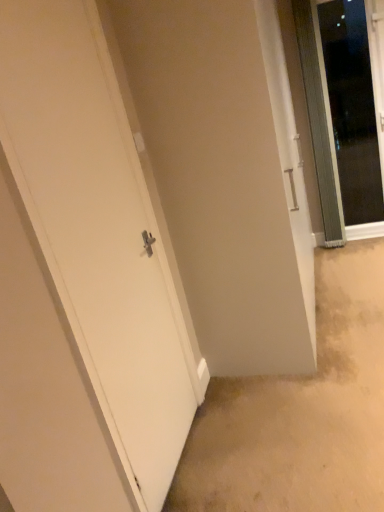
Question: Should I look upward or downward to see transparent glass door at upper right, the first door from the back?

Choices:
 (A) up
 (B) down

Answer: (A)

Question: Is transparent glass door at upper right, the 2th door positioned from the front, further to camera compared to white matte door at left, the second door when ordered from right to left?

Choices:
 (A) yes
 (B) no

Answer: (A)

Question: Could you tell me if transparent glass door at upper right, the 2th door positioned from the front, is facing white matte door at left, the second door when ordered from right to left?

Choices:
 (A) no
 (B) yes

Answer: (A)

Question: Is transparent glass door at upper right, the first door from the back, not near white matte door at left, the first door from the left?

Choices:
 (A) no
 (B) yes

Answer: (B)

Question: Is white matte door at left, which ranks as the 2th door in back-to-front order, at the back of transparent glass door at upper right, the 2th door positioned from the front?

Choices:
 (A) no
 (B) yes

Answer: (A)

Question: Can you confirm if transparent glass door at upper right, the 2th door positioned from the front, is positioned to the right of white matte door at left, which ranks as the 2th door in back-to-front order?

Choices:
 (A) yes
 (B) no

Answer: (A)

Question: Is transparent glass door at upper right, the first door from the back, next to white matte door at left, placed as the 1th door when sorted from front to back?

Choices:
 (A) yes
 (B) no

Answer: (B)

Question: From a real-world perspective, is white matte door at left, the first door from the left, below transparent glass door at upper right, the first door from the back?

Choices:
 (A) no
 (B) yes

Answer: (B)

Question: Can you confirm if white matte door at left, which ranks as the 2th door in back-to-front order, is wider than transparent glass door at upper right, the first door from the back?

Choices:
 (A) no
 (B) yes

Answer: (B)

Question: From the image's perspective, would you say white matte door at left, the first door from the left, is positioned over transparent glass door at upper right, which is counted as the 2th door, starting from the left?

Choices:
 (A) no
 (B) yes

Answer: (A)

Question: From a real-world perspective, is white matte door at left, the first door from the left, located higher than transparent glass door at upper right, marked as the first door in a right-to-left arrangement?

Choices:
 (A) yes
 (B) no

Answer: (B)

Question: Are white matte door at left, which ranks as the 2th door in back-to-front order, and transparent glass door at upper right, marked as the first door in a right-to-left arrangement, far apart?

Choices:
 (A) yes
 (B) no

Answer: (A)

Question: Does white matte door at left, the first door from the left, appear on the left side of transparent glass door at upper right, the 2th door positioned from the front?

Choices:
 (A) no
 (B) yes

Answer: (B)

Question: Looking at their shapes, would you say transparent glass door at upper right, marked as the first door in a right-to-left arrangement, is wider or thinner than white matte door at left, which ranks as the 2th door in back-to-front order?

Choices:
 (A) thin
 (B) wide

Answer: (A)